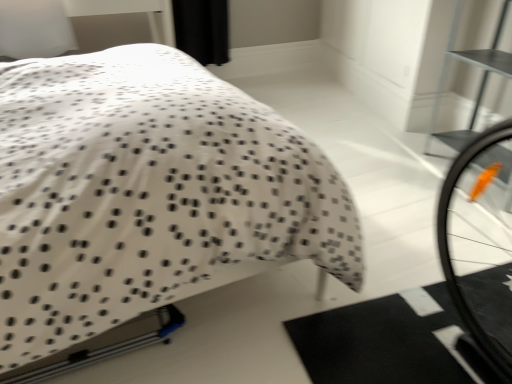
Where is `vacant space underneath metallic silver bookshelf at upper right (from a real-world perspective)`? vacant space underneath metallic silver bookshelf at upper right (from a real-world perspective) is located at coordinates (482, 165).